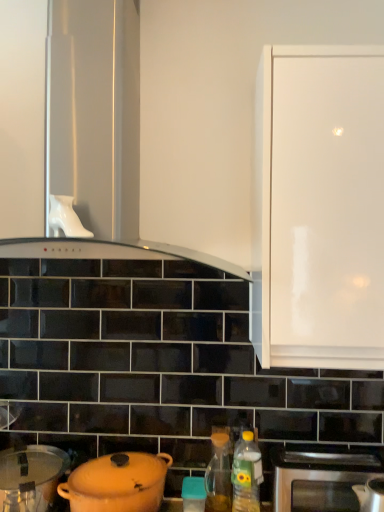
Question: Is white glossy cabinet at upper right to the right of translucent plastic bottle at lower right, the second bottle when ordered from back to front, from the viewer's perspective?

Choices:
 (A) yes
 (B) no

Answer: (A)

Question: Is white glossy cabinet at upper right wider than translucent plastic bottle at lower right, which appears as the 1th bottle when viewed from the front?

Choices:
 (A) no
 (B) yes

Answer: (B)

Question: Is white glossy cabinet at upper right aimed at translucent plastic bottle at lower right, which is the 2th bottle in left-to-right order?

Choices:
 (A) no
 (B) yes

Answer: (A)

Question: Can you confirm if white glossy cabinet at upper right is shorter than translucent plastic bottle at lower right, which is the 2th bottle in left-to-right order?

Choices:
 (A) no
 (B) yes

Answer: (A)

Question: From a real-world perspective, is white glossy cabinet at upper right located beneath translucent plastic bottle at lower right, which is the 2th bottle in left-to-right order?

Choices:
 (A) yes
 (B) no

Answer: (B)

Question: Considering the positions of stainless steel oven at lower right and white glossy range hood at upper center in the image, is stainless steel oven at lower right wider or thinner than white glossy range hood at upper center?

Choices:
 (A) wide
 (B) thin

Answer: (B)

Question: Is stainless steel oven at lower right to the left or to the right of white glossy range hood at upper center in the image?

Choices:
 (A) right
 (B) left

Answer: (A)

Question: Is stainless steel oven at lower right in front of or behind white glossy range hood at upper center in the image?

Choices:
 (A) front
 (B) behind

Answer: (B)

Question: Considering the positions of stainless steel oven at lower right and white glossy range hood at upper center in the image, is stainless steel oven at lower right bigger or smaller than white glossy range hood at upper center?

Choices:
 (A) big
 (B) small

Answer: (B)

Question: Considering the positions of point pyautogui.click(x=210, y=488) and point pyautogui.click(x=284, y=307), is point pyautogui.click(x=210, y=488) closer or farther from the camera than point pyautogui.click(x=284, y=307)?

Choices:
 (A) farther
 (B) closer

Answer: (A)

Question: Considering their positions, is translucent glass oil at lower center, marked as the second bottle in a right-to-left arrangement, located in front of or behind white glossy cabinet at upper right?

Choices:
 (A) behind
 (B) front

Answer: (A)

Question: From a real-world perspective, is translucent glass oil at lower center, which is the first bottle from back to front, physically located above or below white glossy cabinet at upper right?

Choices:
 (A) below
 (B) above

Answer: (A)

Question: Is translucent glass oil at lower center, which is counted as the second bottle, starting from the front, inside or outside of white glossy cabinet at upper right?

Choices:
 (A) outside
 (B) inside

Answer: (A)

Question: Which is correct: white glossy range hood at upper center is inside matte plastic container at center, or outside of it?

Choices:
 (A) inside
 (B) outside

Answer: (B)

Question: Does point (125, 125) appear closer or farther from the camera than point (193, 489)?

Choices:
 (A) farther
 (B) closer

Answer: (B)